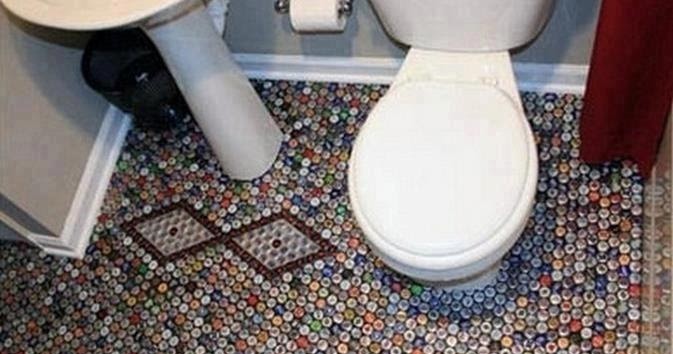
At what (x,y) coordinates should I click in order to perform the action: click on toilet tank. Please return your answer as a coordinate pair (x, y). This screenshot has width=673, height=354. Looking at the image, I should click on (456, 28).